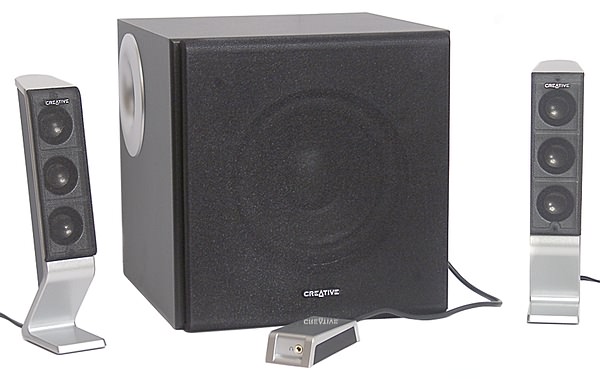
Identify the location of 1 left small speaker. (57, 191).